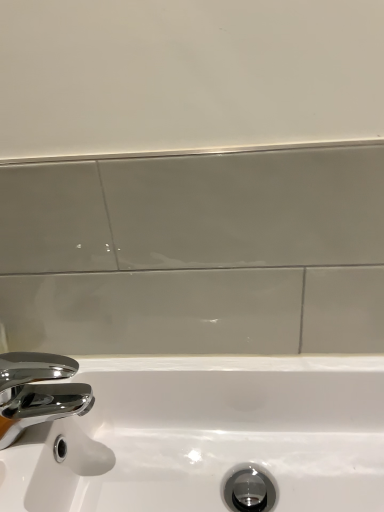
Where is `white glossy sink at lower left`? white glossy sink at lower left is located at coordinates (209, 435).

What do you see at coordinates (209, 435) in the screenshot? The height and width of the screenshot is (512, 384). I see `white glossy sink at lower left` at bounding box center [209, 435].

What is the approximate height of chrome/metallic faucet at lower left?

chrome/metallic faucet at lower left is 10.97 centimeters tall.

You are a GUI agent. You are given a task and a screenshot of the screen. Output one action in this format:
    pyautogui.click(x=<x>, y=<y>)
    Task: Click on the chrome/metallic faucet at lower left
    The width and height of the screenshot is (384, 512).
    Given the screenshot: What is the action you would take?
    pyautogui.click(x=38, y=392)

Describe the element at coordinates (38, 392) in the screenshot. I see `chrome/metallic faucet at lower left` at that location.

Locate an element on the screen. The image size is (384, 512). white glossy sink at lower left is located at coordinates (209, 435).

Considering the relative positions of chrome/metallic faucet at lower left and white glossy sink at lower left in the image provided, is chrome/metallic faucet at lower left to the left of white glossy sink at lower left from the viewer's perspective?

Yes, chrome/metallic faucet at lower left is to the left of white glossy sink at lower left.

Looking at this image, considering their positions, is chrome/metallic faucet at lower left located in front of or behind white glossy sink at lower left?

Clearly, chrome/metallic faucet at lower left is behind white glossy sink at lower left.

Which point is more distant from viewer, (x=20, y=418) or (x=167, y=501)?

Positioned behind is point (x=167, y=501).

From the image's perspective, who appears lower, chrome/metallic faucet at lower left or white glossy sink at lower left?

white glossy sink at lower left appears lower in the image.

From a real-world perspective, which is physically below, chrome/metallic faucet at lower left or white glossy sink at lower left?

white glossy sink at lower left is physically lower.

Which object is thinner, chrome/metallic faucet at lower left or white glossy sink at lower left?

Thinner between the two is chrome/metallic faucet at lower left.

Who is shorter, chrome/metallic faucet at lower left or white glossy sink at lower left?

chrome/metallic faucet at lower left.

Which of these two, chrome/metallic faucet at lower left or white glossy sink at lower left, is smaller?

chrome/metallic faucet at lower left.

Based on the photo, is chrome/metallic faucet at lower left situated inside white glossy sink at lower left or outside?

The correct answer is: outside.

Are chrome/metallic faucet at lower left and white glossy sink at lower left far apart?

No.

From the picture: Is chrome/metallic faucet at lower left oriented towards white glossy sink at lower left?

No, chrome/metallic faucet at lower left is not oriented towards white glossy sink at lower left.

This screenshot has width=384, height=512. Find the location of `sink directly beneath the chrome/metallic faucet at lower left (from a real-world perspective)`. sink directly beneath the chrome/metallic faucet at lower left (from a real-world perspective) is located at coordinates tap(209, 435).

Which object is positioned more to the left, white glossy sink at lower left or chrome/metallic faucet at lower left?

Positioned to the left is chrome/metallic faucet at lower left.

In the image, is white glossy sink at lower left positioned in front of or behind chrome/metallic faucet at lower left?

In the image, white glossy sink at lower left appears in front of chrome/metallic faucet at lower left.

Considering the positions of points (96, 419) and (72, 393), is point (96, 419) closer to camera compared to point (72, 393)?

No, it is behind (72, 393).

From the image's perspective, is white glossy sink at lower left above or below chrome/metallic faucet at lower left?

Clearly, from the image's perspective, white glossy sink at lower left is below chrome/metallic faucet at lower left.

From a real-world perspective, is white glossy sink at lower left positioned over chrome/metallic faucet at lower left based on gravity?

Actually, white glossy sink at lower left is physically below chrome/metallic faucet at lower left in the real world.

In terms of width, does white glossy sink at lower left look wider or thinner when compared to chrome/metallic faucet at lower left?

Considering their sizes, white glossy sink at lower left looks broader than chrome/metallic faucet at lower left.

Who is shorter, white glossy sink at lower left or chrome/metallic faucet at lower left?

chrome/metallic faucet at lower left.

Is white glossy sink at lower left smaller than chrome/metallic faucet at lower left?

No, white glossy sink at lower left is not smaller than chrome/metallic faucet at lower left.

Consider the image. Is chrome/metallic faucet at lower left surrounded by white glossy sink at lower left?

Definitely not — chrome/metallic faucet at lower left is not inside white glossy sink at lower left.

Does white glossy sink at lower left touch chrome/metallic faucet at lower left?

No.

Is white glossy sink at lower left aimed at chrome/metallic faucet at lower left?

No, white glossy sink at lower left is not facing towards chrome/metallic faucet at lower left.

What's the angular difference between white glossy sink at lower left and chrome/metallic faucet at lower left's facing directions?

They differ by 89.2 degrees in their facing directions.

Where is `sink located in front of the chrome/metallic faucet at lower left`? sink located in front of the chrome/metallic faucet at lower left is located at coordinates (209, 435).

Locate an element on the screen. sink on the right of chrome/metallic faucet at lower left is located at coordinates (209, 435).

At what (x,y) coordinates should I click in order to perform the action: click on tap located above the white glossy sink at lower left (from the image's perspective). Please return your answer as a coordinate pair (x, y). The width and height of the screenshot is (384, 512). Looking at the image, I should click on (38, 392).